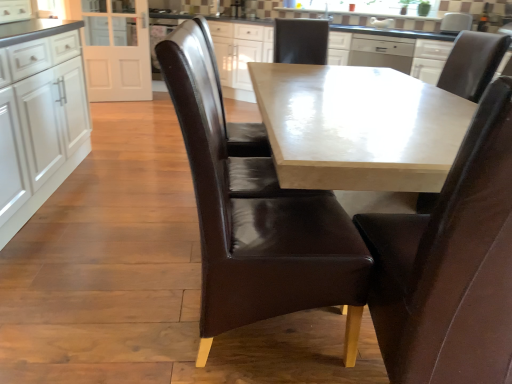
Question: Is brown leather chair at center, positioned as the 2th chair in left-to-right order, bigger than brown leather chair at center, marked as the third chair in a left-to-right arrangement?

Choices:
 (A) no
 (B) yes

Answer: (B)

Question: Considering the relative sizes of brown leather chair at center, positioned as the 2th chair in left-to-right order, and brown leather chair at center, marked as the third chair in a left-to-right arrangement, in the image provided, is brown leather chair at center, positioned as the 2th chair in left-to-right order, shorter than brown leather chair at center, marked as the third chair in a left-to-right arrangement,?

Choices:
 (A) no
 (B) yes

Answer: (A)

Question: Is brown leather chair at center, positioned as the 2th chair in left-to-right order, wider than brown leather chair at center, positioned as the 2th chair in right-to-left order?

Choices:
 (A) yes
 (B) no

Answer: (A)

Question: From a real-world perspective, is brown leather chair at center, acting as the 3th chair starting from the right, located beneath brown leather chair at center, marked as the third chair in a left-to-right arrangement?

Choices:
 (A) no
 (B) yes

Answer: (A)

Question: Is brown leather chair at center, positioned as the 2th chair in left-to-right order, at the left side of brown leather chair at center, marked as the third chair in a left-to-right arrangement?

Choices:
 (A) no
 (B) yes

Answer: (B)

Question: From the image's perspective, relative to brown leather chair at upper right, the fourth chair viewed from the left, is brown leather chair at center, marked as the third chair in a left-to-right arrangement, above or below?

Choices:
 (A) below
 (B) above

Answer: (A)

Question: Considering the positions of point (493, 100) and point (474, 38), is point (493, 100) closer or farther from the camera than point (474, 38)?

Choices:
 (A) farther
 (B) closer

Answer: (B)

Question: Is brown leather chair at center, marked as the third chair in a left-to-right arrangement, taller or shorter than brown leather chair at upper right, which is the 1th chair in right-to-left order?

Choices:
 (A) short
 (B) tall

Answer: (B)

Question: In terms of width, does brown leather chair at center, marked as the third chair in a left-to-right arrangement, look wider or thinner when compared to brown leather chair at upper right, which is the 1th chair in right-to-left order?

Choices:
 (A) wide
 (B) thin

Answer: (A)

Question: Looking at the image, does brown leather chair at center, positioned as the 2th chair in right-to-left order, seem bigger or smaller compared to white glossy cabinets at left, positioned as the second cabinetry in back-to-front order?

Choices:
 (A) small
 (B) big

Answer: (A)

Question: Is brown leather chair at center, marked as the third chair in a left-to-right arrangement, in front of or behind white glossy cabinets at left, which is the 1th cabinetry in front-to-back order, in the image?

Choices:
 (A) front
 (B) behind

Answer: (A)

Question: Considering the positions of point (451, 311) and point (18, 51), is point (451, 311) closer or farther from the camera than point (18, 51)?

Choices:
 (A) closer
 (B) farther

Answer: (A)

Question: From a real-world perspective, is brown leather chair at center, positioned as the 2th chair in right-to-left order, above or below white glossy cabinets at left, the first cabinetry in the left-to-right sequence?

Choices:
 (A) below
 (B) above

Answer: (A)

Question: Is brown leather chair at center, marked as the third chair in a left-to-right arrangement, bigger or smaller than brown leather chair at center, marked as the 4th chair in a right-to-left arrangement?

Choices:
 (A) big
 (B) small

Answer: (B)

Question: Is brown leather chair at center, positioned as the 2th chair in right-to-left order, inside or outside of brown leather chair at center, marked as the 4th chair in a right-to-left arrangement?

Choices:
 (A) inside
 (B) outside

Answer: (B)